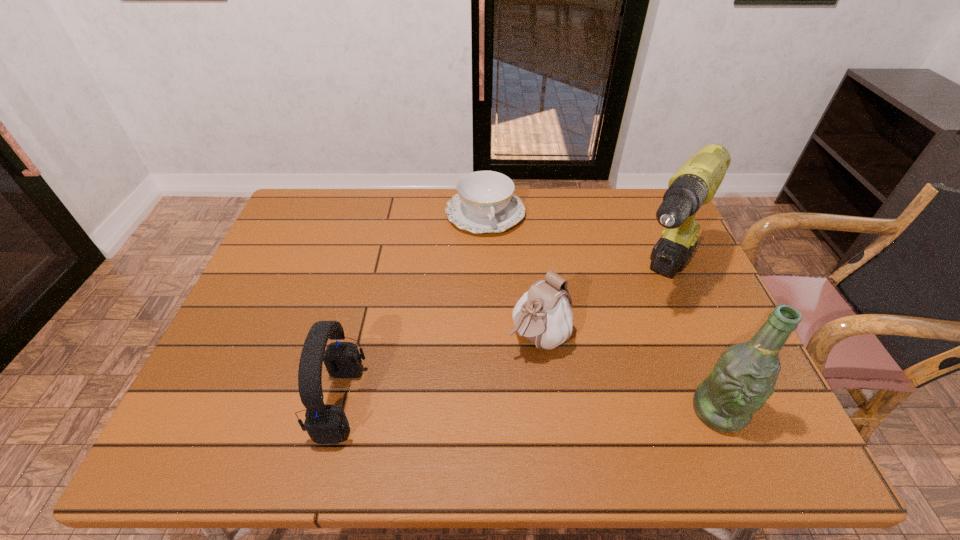
Image resolution: width=960 pixels, height=540 pixels. I want to click on beer bottle positioned at the near edge, so click(744, 377).

You are a GUI agent. You are given a task and a screenshot of the screen. Output one action in this format:
    pyautogui.click(x=<x>, y=<y>)
    Task: Click on the beer bottle that is at the right edge
    Image resolution: width=960 pixels, height=540 pixels.
    Given the screenshot: What is the action you would take?
    pyautogui.click(x=744, y=377)

Where is `drill that is positioned at the right edge`? drill that is positioned at the right edge is located at coordinates (696, 182).

At what (x,y) coordinates should I click in order to perform the action: click on object present at the near right corner. Please return your answer as a coordinate pair (x, y). Looking at the image, I should click on (744, 377).

Where is `vacant position at the far edge of the desktop`? vacant position at the far edge of the desktop is located at coordinates point(398,189).

The image size is (960, 540). I want to click on vacant space at the left edge, so click(x=268, y=278).

The width and height of the screenshot is (960, 540). In order to click on vacant space at the right edge of the desktop in this screenshot , I will do tap(671, 294).

Image resolution: width=960 pixels, height=540 pixels. Identify the location of vacant area at the far left corner. (328, 231).

Locate an element on the screen. The width and height of the screenshot is (960, 540). blank area at the far right corner is located at coordinates (618, 193).

Identify the location of vacant space that's between the leftmost object and the beer bottle. The image size is (960, 540). (529, 406).